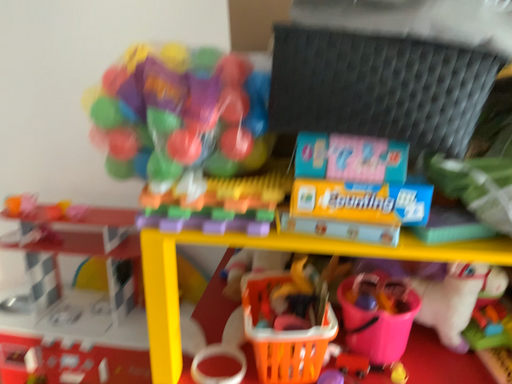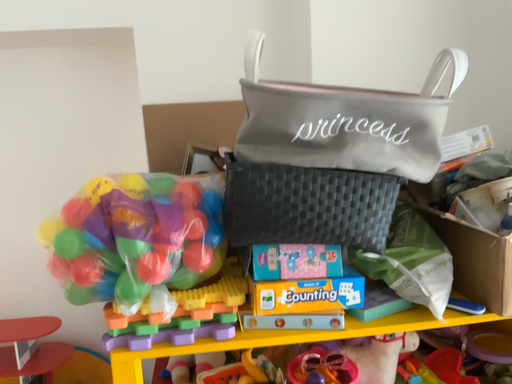
Question: How did the camera likely rotate when shooting the video?

Choices:
 (A) rotated left
 (B) rotated right

Answer: (B)